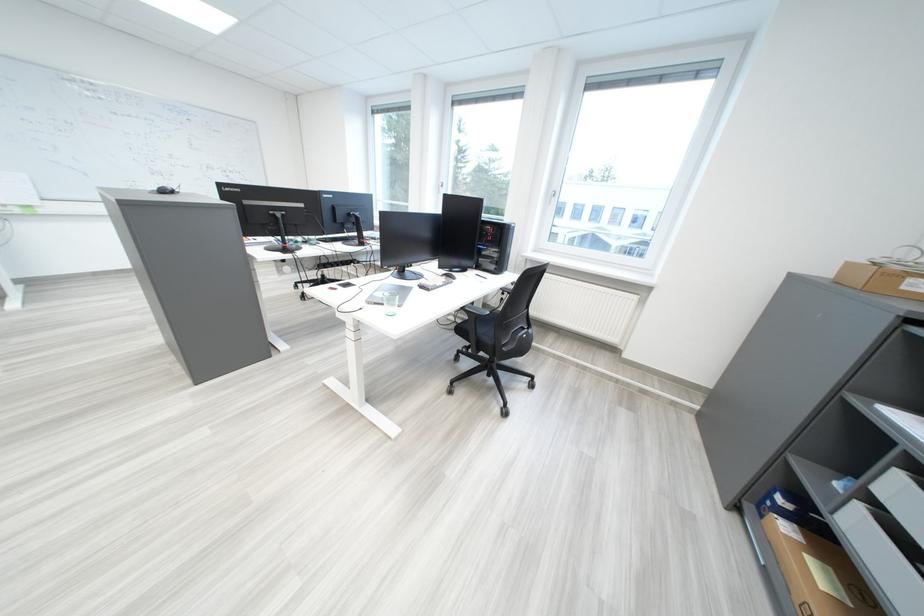
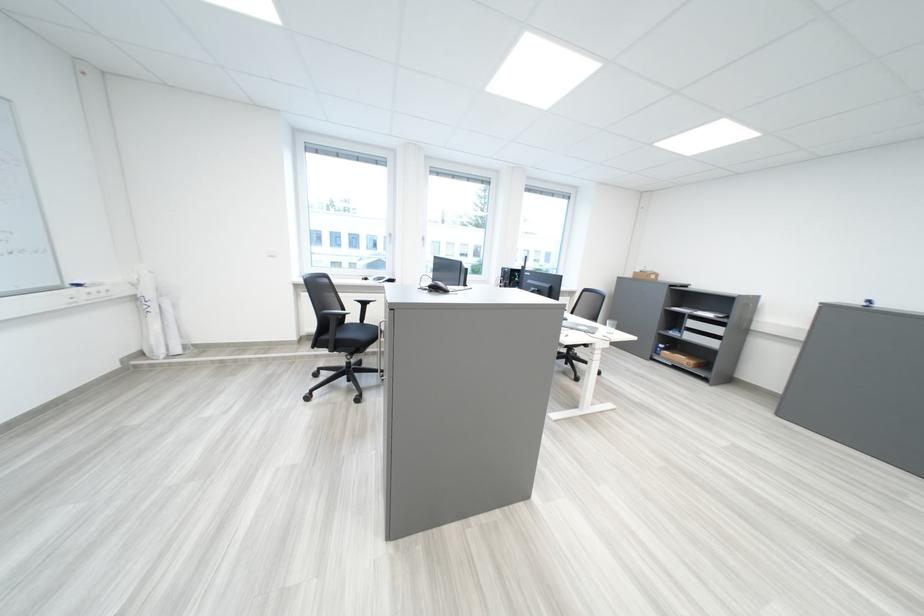
Question: I am providing you with two images of the same scene from different viewpoints. Which of the following objects are not visible in image2?

Choices:
 (A) chair armrest
 (B) black chair sitting surface
 (C) white window handle
 (D) pitcher lid flap

Answer: (A)